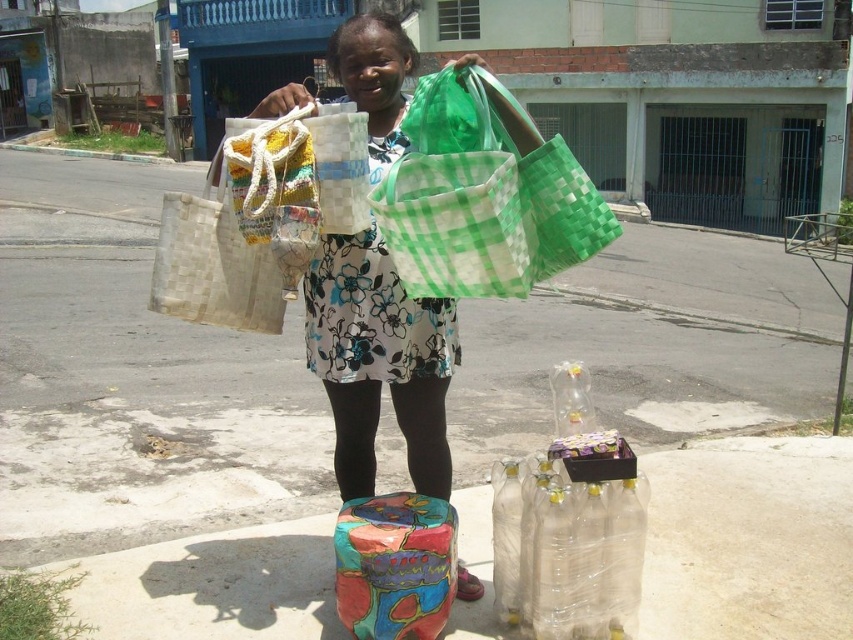
Question: Which of the following is the closest to the observer?

Choices:
 (A) (410, 451)
 (B) (379, 278)

Answer: (B)

Question: Can you confirm if green woven bag at center is thinner than painted fabric bag at center?

Choices:
 (A) no
 (B) yes

Answer: (A)

Question: Considering the relative positions of green woven bag at center and painted fabric bag at center in the image provided, where is green woven bag at center located with respect to painted fabric bag at center?

Choices:
 (A) below
 (B) above

Answer: (B)

Question: Observing the image, what is the correct spatial positioning of matte woven bags at center in reference to green woven bag at center?

Choices:
 (A) above
 (B) below

Answer: (B)

Question: Which point appears farthest from the camera in this image?

Choices:
 (A) (340, 40)
 (B) (495, 252)

Answer: (A)

Question: Among these objects, which one is nearest to the camera?

Choices:
 (A) matte woven bags at center
 (B) painted fabric bag at center

Answer: (A)